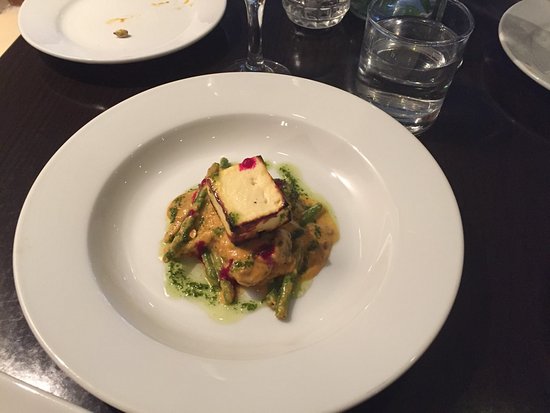
Image resolution: width=550 pixels, height=413 pixels. What are the coordinates of `stemmed glass` in the screenshot? It's located at (257, 46).